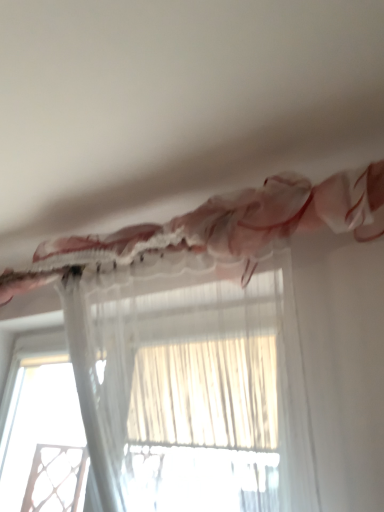
Question: Is transparent fabric at lower left located outside translucent sheer curtain at upper center, marked as the 1th curtain in a bottom-to-top arrangement?

Choices:
 (A) yes
 (B) no

Answer: (A)

Question: Would you consider transparent fabric at lower left to be distant from translucent sheer curtain at upper center, which is counted as the second curtain, starting from the top?

Choices:
 (A) no
 (B) yes

Answer: (B)

Question: Is translucent sheer curtain at upper center, which is counted as the second curtain, starting from the top, at the back of transparent fabric at lower left?

Choices:
 (A) yes
 (B) no

Answer: (B)

Question: Is transparent fabric at lower left behind translucent sheer curtain at upper center, marked as the 1th curtain in a bottom-to-top arrangement?

Choices:
 (A) no
 (B) yes

Answer: (B)

Question: Is transparent fabric at lower left bigger than translucent sheer curtain at upper center, which is counted as the second curtain, starting from the top?

Choices:
 (A) yes
 (B) no

Answer: (B)

Question: Is translucent sheer curtain at upper center, marked as the 1th curtain in a bottom-to-top arrangement, in front of or behind translucent sheer curtain at upper center, the second curtain ordered from the bottom, in the image?

Choices:
 (A) front
 (B) behind

Answer: (A)

Question: In terms of size, does translucent sheer curtain at upper center, which is counted as the second curtain, starting from the top, appear bigger or smaller than translucent sheer curtain at upper center, the 1th curtain viewed from the top?

Choices:
 (A) small
 (B) big

Answer: (A)

Question: From a real-world perspective, relative to translucent sheer curtain at upper center, the second curtain ordered from the bottom, is translucent sheer curtain at upper center, which is counted as the second curtain, starting from the top, vertically above or below?

Choices:
 (A) above
 (B) below

Answer: (B)

Question: Would you say translucent sheer curtain at upper center, marked as the 1th curtain in a bottom-to-top arrangement, is to the left or to the right of translucent sheer curtain at upper center, the 1th curtain viewed from the top, in the picture?

Choices:
 (A) left
 (B) right

Answer: (B)

Question: Is translucent sheer curtain at upper center, the second curtain ordered from the bottom, spatially inside translucent sheer curtain at upper center, which is counted as the second curtain, starting from the top, or outside of it?

Choices:
 (A) inside
 (B) outside

Answer: (B)

Question: From a real-world perspective, is translucent sheer curtain at upper center, the 1th curtain viewed from the top, physically located above or below translucent sheer curtain at upper center, marked as the 1th curtain in a bottom-to-top arrangement?

Choices:
 (A) above
 (B) below

Answer: (A)

Question: Does point (278, 224) appear closer or farther from the camera than point (77, 329)?

Choices:
 (A) farther
 (B) closer

Answer: (B)

Question: Is translucent sheer curtain at upper center, the second curtain ordered from the bottom, wider or thinner than translucent sheer curtain at upper center, marked as the 1th curtain in a bottom-to-top arrangement?

Choices:
 (A) wide
 (B) thin

Answer: (A)

Question: Considering the relative positions of translucent sheer curtain at upper center, which is counted as the second curtain, starting from the top, and transparent fabric at lower left in the image provided, is translucent sheer curtain at upper center, which is counted as the second curtain, starting from the top, to the left or to the right of transparent fabric at lower left?

Choices:
 (A) left
 (B) right

Answer: (B)

Question: Considering the positions of translucent sheer curtain at upper center, which is counted as the second curtain, starting from the top, and transparent fabric at lower left in the image, is translucent sheer curtain at upper center, which is counted as the second curtain, starting from the top, taller or shorter than transparent fabric at lower left?

Choices:
 (A) tall
 (B) short

Answer: (A)